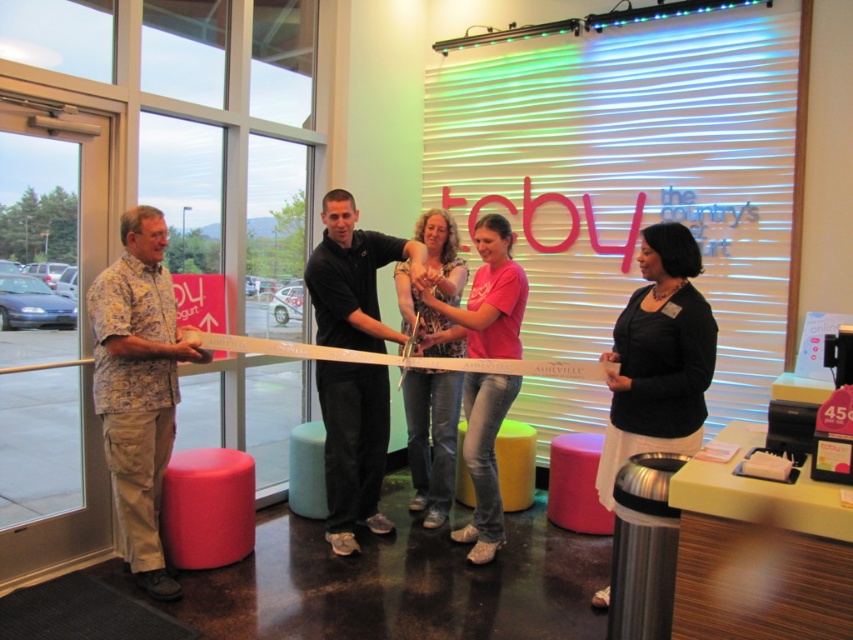
Question: Which point is farther from the camera taking this photo?

Choices:
 (A) (148, 278)
 (B) (596, 508)
 (C) (521, 499)
 (D) (173, 540)

Answer: (C)

Question: Does matte red stool at lower left appear on the right side of yellow fabric stool at center?

Choices:
 (A) no
 (B) yes

Answer: (A)

Question: Which of the following is the closest to the observer?

Choices:
 (A) printed cotton blouse at center
 (B) black matte jacket at center
 (C) teal fabric stool at center

Answer: (B)

Question: Among these points, which one is farthest from the camera?

Choices:
 (A) (480, 236)
 (B) (610, 451)

Answer: (A)

Question: Is the position of black smooth shirt at center more distant than that of matte red stool at lower left?

Choices:
 (A) no
 (B) yes

Answer: (B)

Question: Is black smooth shirt at center to the right of printed cotton blouse at center from the viewer's perspective?

Choices:
 (A) yes
 (B) no

Answer: (B)